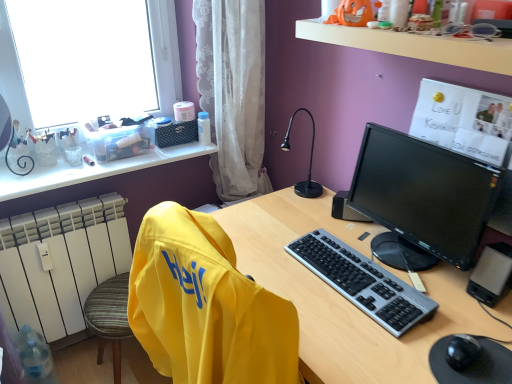
This screenshot has width=512, height=384. What do you see at coordinates (205, 306) in the screenshot? I see `yellow fabric swivel chair at left` at bounding box center [205, 306].

The width and height of the screenshot is (512, 384). What do you see at coordinates (422, 199) in the screenshot?
I see `black glossy monitor at center right` at bounding box center [422, 199].

Identify the location of black glossy monitor at center right. (422, 199).

The width and height of the screenshot is (512, 384). What do you see at coordinates (233, 91) in the screenshot?
I see `white lace curtain at center` at bounding box center [233, 91].

What do you see at coordinates (415, 45) in the screenshot? I see `white plastic window sill at upper center` at bounding box center [415, 45].

Image resolution: width=512 pixels, height=384 pixels. In order to click on black plastic keyboard at center in this screenshot , I will do `click(362, 282)`.

The image size is (512, 384). What do you see at coordinates (462, 352) in the screenshot?
I see `black rubber mouse at lower right` at bounding box center [462, 352].

The image size is (512, 384). I want to click on yellow fabric swivel chair at left, so click(205, 306).

Is matte plastic desk at center at the left side of black rubber mouse at lower right?

Yes, matte plastic desk at center is to the left of black rubber mouse at lower right.

From a real-world perspective, is matte plastic desk at center positioned above or below black rubber mouse at lower right?

In terms of real-world spatial position, matte plastic desk at center is below black rubber mouse at lower right.

How far apart are matte plastic desk at center and black rubber mouse at lower right?

A distance of 15.80 inches exists between matte plastic desk at center and black rubber mouse at lower right.

Is matte plastic desk at center far away from black rubber mouse at lower right?

No, matte plastic desk at center is not far from black rubber mouse at lower right.

Is black rubber mouse at lower right inside the boundaries of black glossy monitor at center right, or outside?

The correct answer is: outside.

Is black rubber mouse at lower right bigger than black glossy monitor at center right?

No, black rubber mouse at lower right is not bigger than black glossy monitor at center right.

Between point (474, 351) and point (377, 241), which one is positioned behind?

Positioned behind is point (377, 241).

From the image's perspective, between white plastic radiator at left and black plastic keyboard at center, which one is located above?

From the image's view, black plastic keyboard at center is above.

Considering the positions of objects white plastic radiator at left and black plastic keyboard at center in the image provided, who is more to the right, white plastic radiator at left or black plastic keyboard at center?

Positioned to the right is black plastic keyboard at center.

Is point (46, 275) positioned in front of point (331, 255)?

That is False.

Based on the photo, could you tell me if white plastic radiator at left is turned towards black plastic keyboard at center?

No, white plastic radiator at left is not facing towards black plastic keyboard at center.

From the picture: From the image's perspective, between black rubber mouse at lower right and white plastic radiator at left, who is located below?

black rubber mouse at lower right appears lower in the image.

Is black rubber mouse at lower right turned away from white plastic radiator at left?

No, black rubber mouse at lower right's orientation is not away from white plastic radiator at left.

Is black rubber mouse at lower right in front of white plastic radiator at left?

That is True.

Considering the sizes of black rubber mouse at lower right and white plastic radiator at left in the image, is black rubber mouse at lower right wider or thinner than white plastic radiator at left?

Considering their sizes, black rubber mouse at lower right looks slimmer than white plastic radiator at left.

Based on the photo, from a real-world perspective, is black plastic computer tower at lower right on top of white lace curtain at center?

No, from a real-world perspective, black plastic computer tower at lower right is not on top of white lace curtain at center.

Is black plastic computer tower at lower right outside of white lace curtain at center?

black plastic computer tower at lower right lies outside white lace curtain at center's area.

From the picture: Is black plastic computer tower at lower right far from white lace curtain at center?

That's right, there is a large distance between black plastic computer tower at lower right and white lace curtain at center.

In the scene shown: From the image's perspective, is black plastic keyboard at center located above or below white lace curtain at center?

black plastic keyboard at center is below white lace curtain at center.

Locate an element on the screen. The width and height of the screenshot is (512, 384). computer keyboard below the white lace curtain at center (from a real-world perspective) is located at coordinates (362, 282).

Is point (307, 266) closer or farther from the camera than point (249, 141)?

Clearly, point (307, 266) is closer to the camera than point (249, 141).

Considering the relative sizes of black plastic keyboard at center and white lace curtain at center in the image provided, is black plastic keyboard at center smaller than white lace curtain at center?

Yes.

Can you tell me how much black plastic speaker at right and white plastic radiator at left differ in facing direction?

There is a 48-degree angle between the facing directions of black plastic speaker at right and white plastic radiator at left.

Which of these two, black plastic speaker at right or white plastic radiator at left, is bigger?

white plastic radiator at left is bigger.

Is black plastic speaker at right beside white plastic radiator at left?

No.

Would you say black plastic speaker at right is outside white plastic radiator at left?

Yes.

Find the location of a particular element. This screenshot has width=512, height=384. desk in front of the black rubber mouse at lower right is located at coordinates (342, 296).

I want to click on mouse below the black glossy monitor at center right (from a real-world perspective), so click(x=462, y=352).

Based on the photo, looking at the image, which one is located closer to yellow fabric swivel chair at left, black plastic computer tower at lower right or black glossy monitor at center right?

black glossy monitor at center right.

From the image, which object appears to be farther from white plastic radiator at left, matte plastic desk at center or black glossy monitor at center right?

Among the two, black glossy monitor at center right is located further to white plastic radiator at left.

Considering their positions, is black plastic speaker at right positioned closer to black plastic keyboard at center than matte plastic desk at center?

matte plastic desk at center is positioned closer to the anchor black plastic keyboard at center.

Consider the image. Looking at the image, which one is located closer to white plastic radiator at left, white plastic window sill at upper center or black plastic keyboard at center?

Based on the image, black plastic keyboard at center appears to be nearer to white plastic radiator at left.

Estimate the real-world distances between objects in this image. Which object is closer to white lace curtain at center, black glossy monitor at center right or black rubber mouse at lower right?

Among the two, black glossy monitor at center right is located nearer to white lace curtain at center.

Considering their positions, is black glossy monitor at center right positioned further to white lace curtain at center than black plastic computer tower at lower right?

Among the two, black plastic computer tower at lower right is located further to white lace curtain at center.

When comparing their distances from black glossy monitor at center right, does matte plastic desk at center or black plastic computer tower at lower right seem closer?

The object closer to black glossy monitor at center right is matte plastic desk at center.

When comparing their distances from white lace curtain at center, does white plastic window sill at upper center or black glossy monitor at center right seem further?

black glossy monitor at center right lies further to white lace curtain at center than the other object.

Where is `curtain between white plastic radiator at left and white plastic window sill at upper center from left to right`? Image resolution: width=512 pixels, height=384 pixels. curtain between white plastic radiator at left and white plastic window sill at upper center from left to right is located at coordinates (233, 91).

Where is `computer monitor situated between white plastic radiator at left and black rubber mouse at lower right from left to right`? The width and height of the screenshot is (512, 384). computer monitor situated between white plastic radiator at left and black rubber mouse at lower right from left to right is located at coordinates (422, 199).

At what (x,y) coordinates should I click in order to perform the action: click on mouse situated between black plastic keyboard at center and black plastic computer tower at lower right from left to right. Please return your answer as a coordinate pair (x, y). This screenshot has height=384, width=512. Looking at the image, I should click on (462, 352).

The width and height of the screenshot is (512, 384). Identify the location of computer keyboard between yellow fabric swivel chair at left and black plastic computer tower at lower right from left to right. (362, 282).